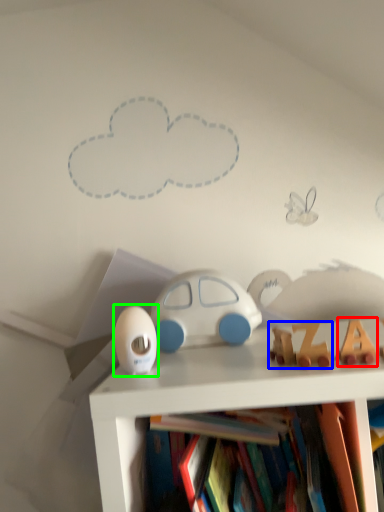
Question: Which object is positioned closest to toy (highlighted by a red box)? Select from toy (highlighted by a blue box) and toy (highlighted by a green box).

Choices:
 (A) toy
 (B) toy

Answer: (A)